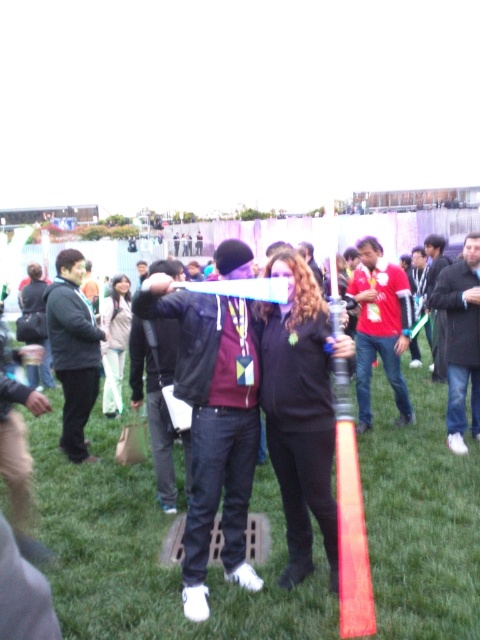
You are a photographer at the event and need to capture a photo where both the green grass at center and the light beige fabric jacket at center are visible. Considering their heights, which object will appear taller in the photo?

The light beige fabric jacket at center will appear taller in the photo since it is taller than the green grass at center.

You are standing in the middle of the grassy field where the event is taking place. If you look down, where would you see the green grass at center?

The green grass at center is located at point (153, 552), so you would see it there when looking down.